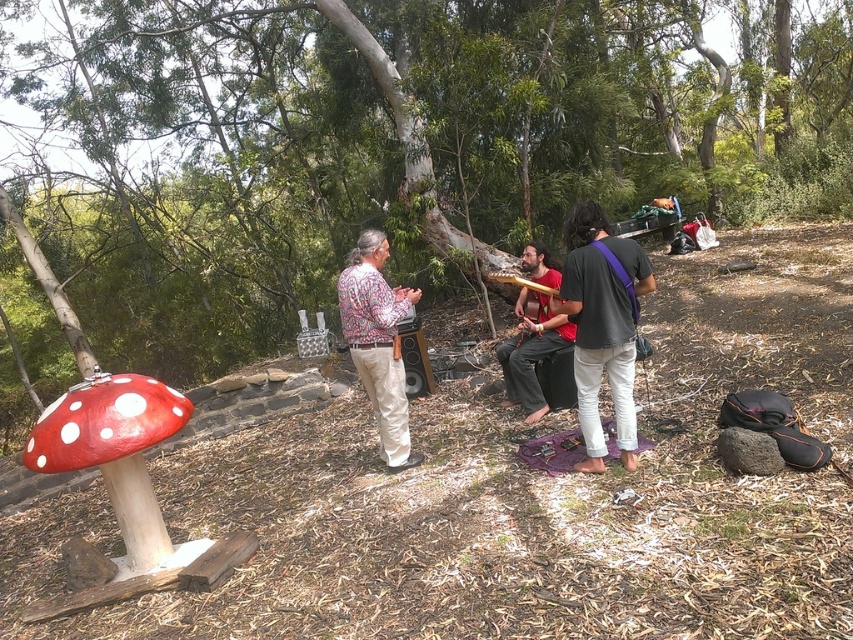
Does point (386, 182) come farther from viewer compared to point (618, 380)?

Yes, point (386, 182) is behind point (618, 380).

Where is `smooth bark tree at center`? The width and height of the screenshot is (853, 640). smooth bark tree at center is located at coordinates (374, 150).

This screenshot has width=853, height=640. Describe the element at coordinates (374, 150) in the screenshot. I see `smooth bark tree at center` at that location.

The width and height of the screenshot is (853, 640). I want to click on smooth bark tree at center, so click(374, 150).

Which is more to the right, smooth bark tree at center or gold metallic xylophone at center?

smooth bark tree at center

Between smooth bark tree at center and gold metallic xylophone at center, which one has more height?

smooth bark tree at center

Between point (13, 176) and point (502, 280), which one is positioned in front?

Point (502, 280) is more forward.

Identify the location of smooth bark tree at center. The height and width of the screenshot is (640, 853). (374, 150).

Image resolution: width=853 pixels, height=640 pixels. What are the coordinates of `floral-patterned shirt at center` in the screenshot? It's located at (378, 342).

Is floral-patterned shirt at center smaller than red fabric guitar at center?

Yes, floral-patterned shirt at center is smaller than red fabric guitar at center.

Is point (387, 460) closer to camera compared to point (515, 362)?

Yes.

The image size is (853, 640). In order to click on floral-patterned shirt at center in this screenshot , I will do `click(378, 342)`.